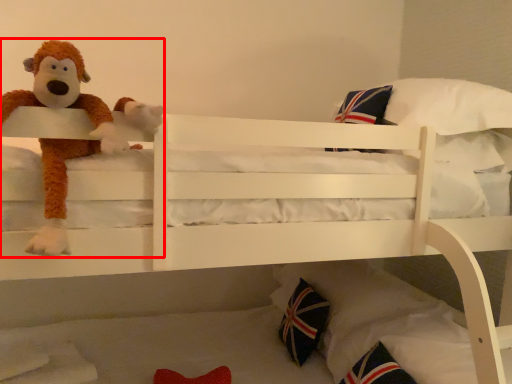
Question: From the image's perspective, where is toy (annotated by the red box) located relative to throw pillow?

Choices:
 (A) below
 (B) above

Answer: (B)